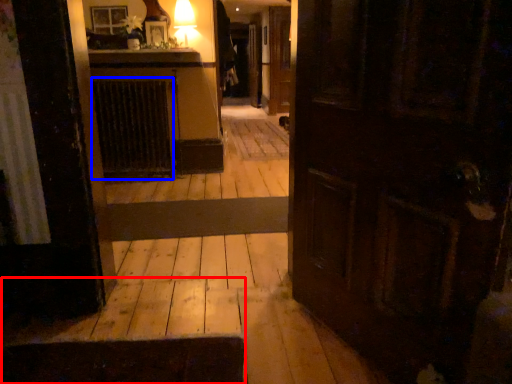
Question: Which point is further to the camera, stairwell (highlighted by a red box) or radiator (highlighted by a blue box)?

Choices:
 (A) stairwell
 (B) radiator

Answer: (B)